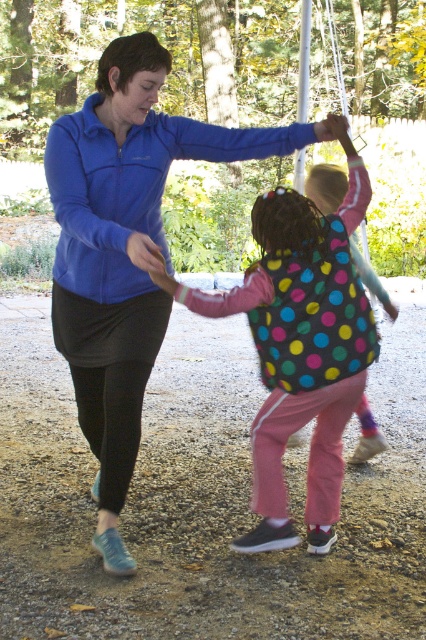
The height and width of the screenshot is (640, 426). What do you see at coordinates (124, 248) in the screenshot? I see `blue fleece jacket at center` at bounding box center [124, 248].

Which is more to the right, blue fleece jacket at center or polka dot fabric jacket at center?

Positioned to the right is polka dot fabric jacket at center.

Which is in front, point (120, 308) or point (350, 323)?

Positioned in front is point (350, 323).

Find the location of a particular element. The height and width of the screenshot is (640, 426). blue fleece jacket at center is located at coordinates (124, 248).